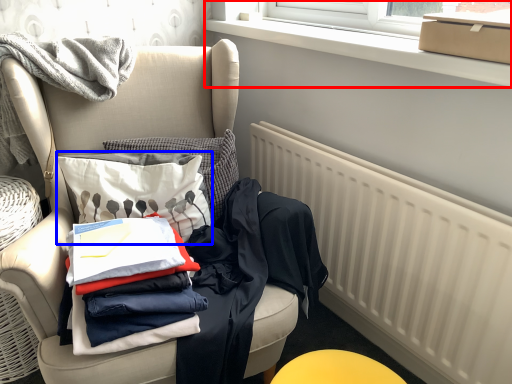
Question: Which of the following is the closest to the observer, window frame (highlighted by a red box) or throw pillow (highlighted by a blue box)?

Choices:
 (A) window frame
 (B) throw pillow

Answer: (A)